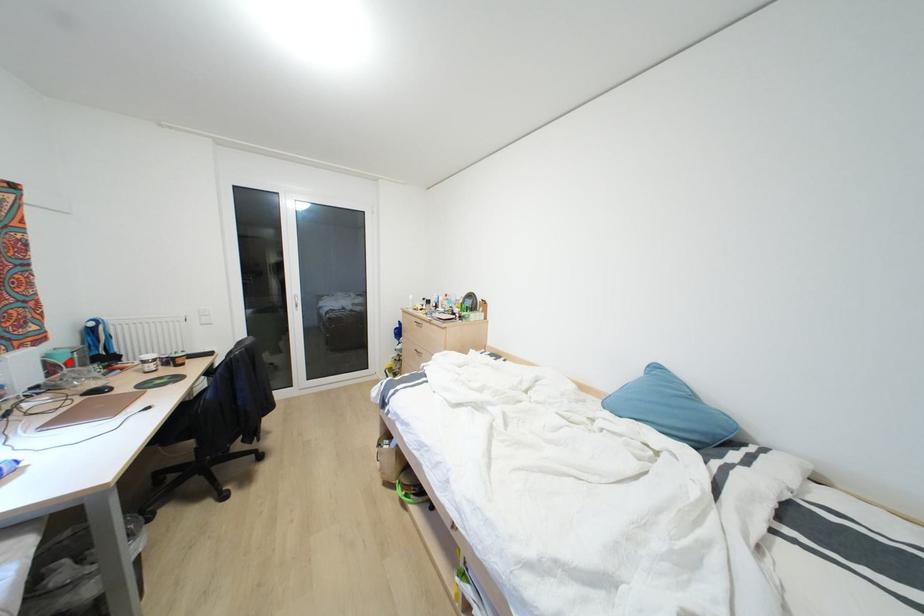
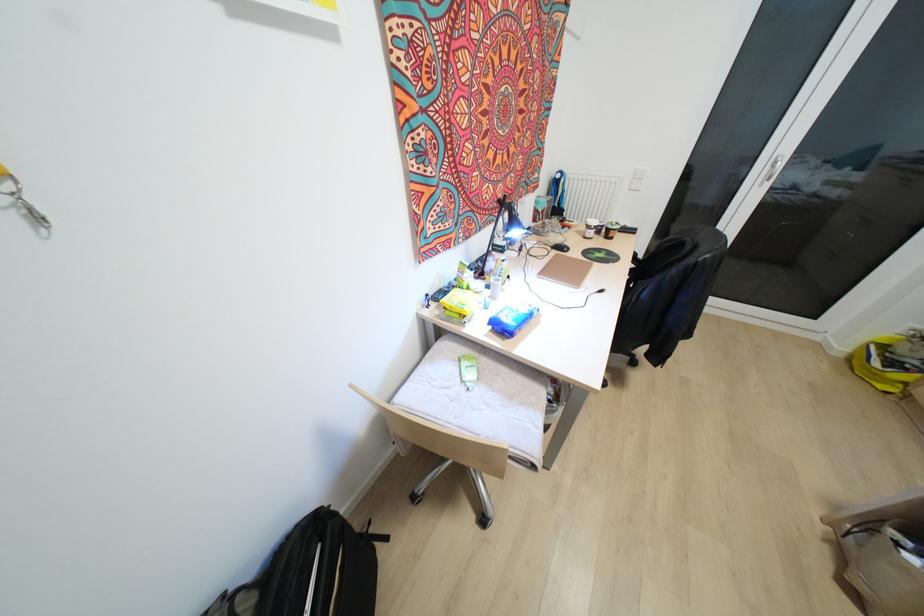
Find the pixel in the second image that matches the highlighted location in the first image.

(541, 209)